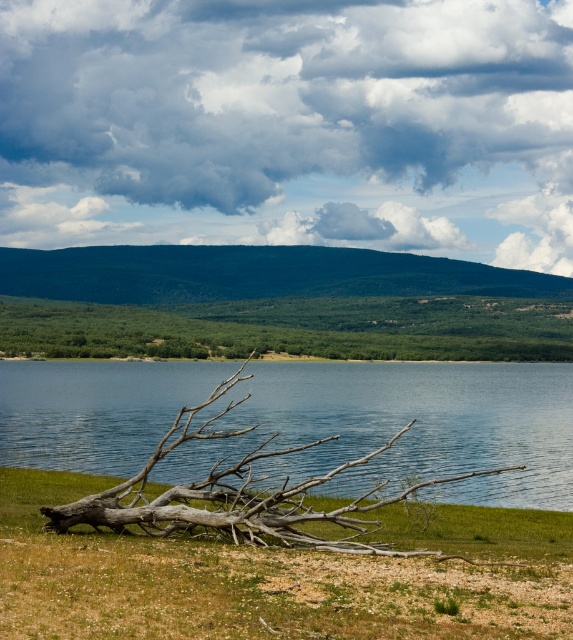
In the scene shown: Can you confirm if cloudy sky at upper center is smaller than green leafy tree at center?

Incorrect, cloudy sky at upper center is not smaller in size than green leafy tree at center.

Which is below, cloudy sky at upper center or green leafy tree at center?

Positioned lower is green leafy tree at center.

Where is `cloudy sky at upper center`? cloudy sky at upper center is located at coordinates (291, 125).

Is clear blue water at center smaller than green leafy tree at center?

Yes.

Is clear blue water at center to the left of green leafy tree at center from the viewer's perspective?

Incorrect, clear blue water at center is not on the left side of green leafy tree at center.

Is point (441, 420) positioned after point (9, 337)?

That is False.

Where is `clear blue water at center`? The width and height of the screenshot is (573, 640). clear blue water at center is located at coordinates (402, 426).

Can you confirm if cloudy sky at upper center is smaller than clear blue water at center?

No, cloudy sky at upper center is not smaller than clear blue water at center.

Is cloudy sky at upper center above clear blue water at center?

Yes.

You are a GUI agent. You are given a task and a screenshot of the screen. Output one action in this format:
    pyautogui.click(x=<x>, y=<y>)
    Task: Click on the cloudy sky at upper center
    
    Given the screenshot: What is the action you would take?
    pyautogui.click(x=291, y=125)